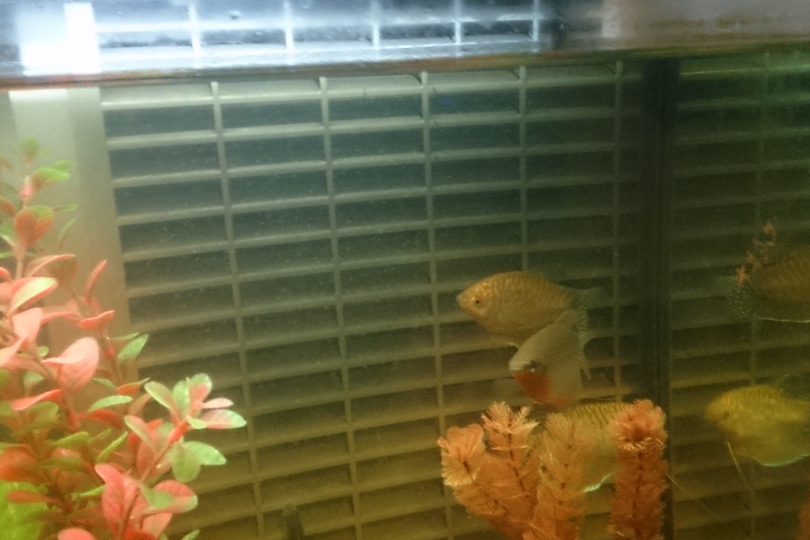
Identify the location of faux plant. (156, 456), (33, 451), (44, 375), (84, 291), (28, 222), (467, 460), (509, 456), (556, 475), (633, 489).